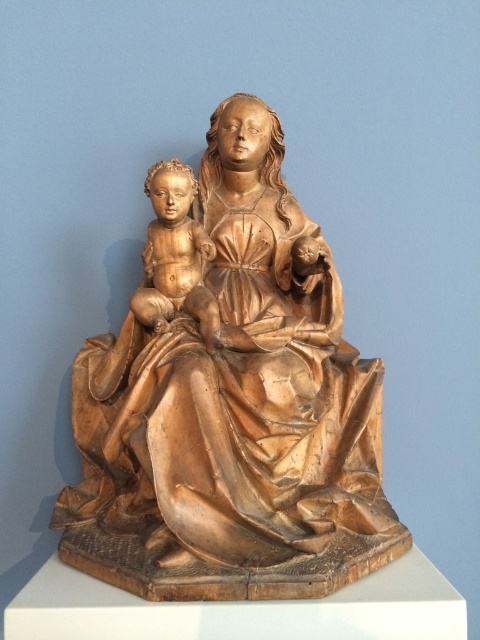
You are an art conservator assessing the dimensions of the wooden statue at center and the wooden baby at center. Which object has a greater width?

The wooden statue at center is wider than the wooden baby at center according to the description.